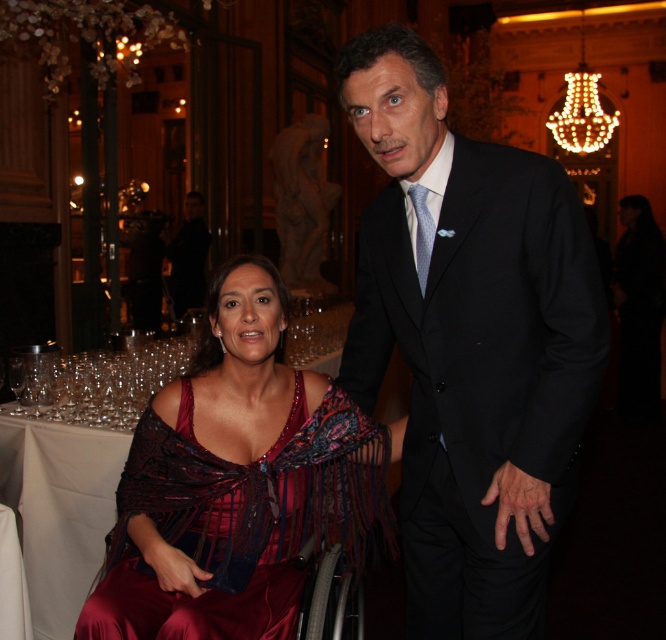
You are a photographer at the event and need to position a microphone stand between the black silk suit at center and the burgundy satin dress at center. If the microphone stand requires 15 cm of space, can it fit between them?

The black silk suit at center is thinner than the burgundy satin dress at center, but the exact distance between them isn not specified. Without knowing the actual space between the two, it is impossible to determine if the microphone stand will fit.

You are a photographer at the event and need to position a spotlight so it can equally illuminate both the black silk suit at center and the burgundy satin dress at center. Considering their heights, which one should be placed closer to the spotlight to ensure even lighting?

The burgundy satin dress at center is shorter than the black silk suit at center, so placing it closer to the spotlight will help achieve even illumination between both garments.

You are a photographer at the event and want to capture a closeup of both the point at (406, 481) and the point at (298, 582). Since you can only focus on one point at a time, which point should you focus on to ensure both are in focus?

You should focus on the point at (298, 582) because it is closer to the camera than the point at (406, 481). By focusing on the closer point, the depth of field will likely include the farther point as well, ensuring both are in focus.